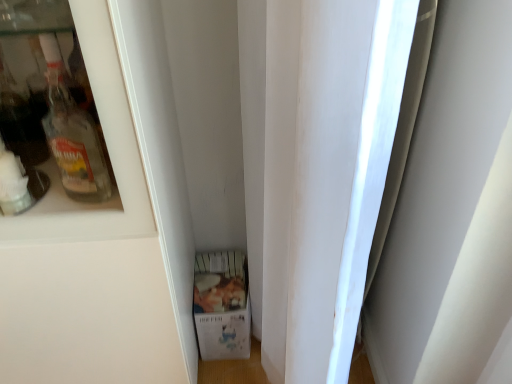
Where is `free space above white cardboard box at center (from a real-world perspective)`? free space above white cardboard box at center (from a real-world perspective) is located at coordinates (219, 279).